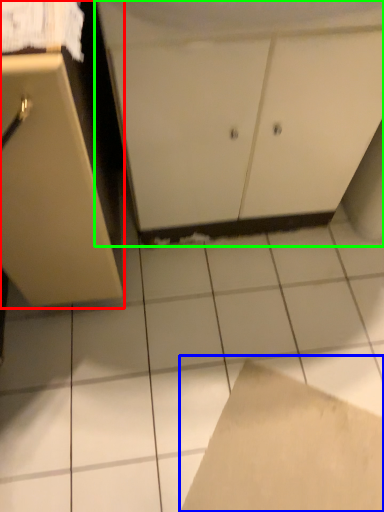
Question: Considering the real-world distances, which object is closest to cabinetry (highlighted by a red box)? cardboard (highlighted by a blue box) or cabinetry (highlighted by a green box).

Choices:
 (A) cardboard
 (B) cabinetry

Answer: (B)